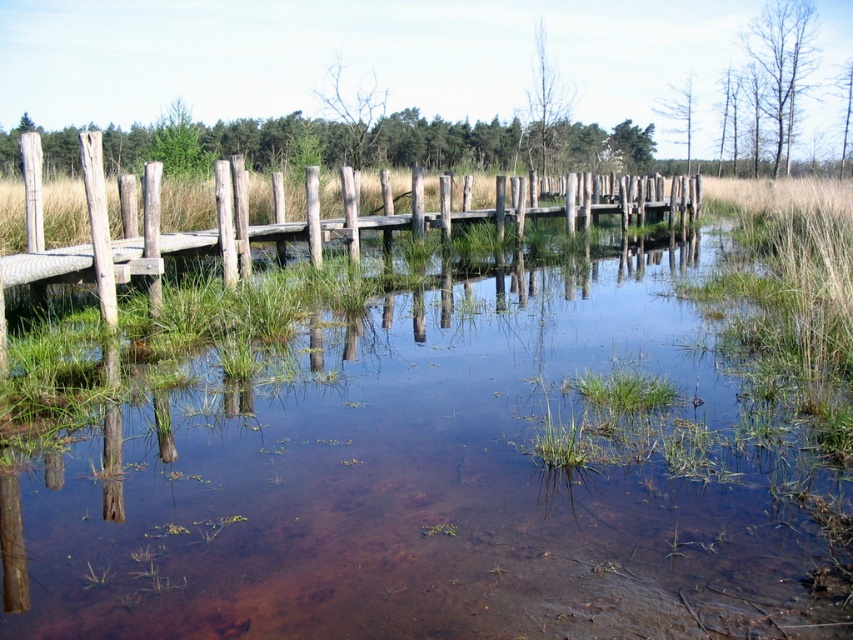
Between point (369, 372) and point (68, 256), which one is positioned behind?

The point (68, 256) is behind.

Is clear water at center positioned in front of wooden planks at center?

No, clear water at center is behind wooden planks at center.

What do you see at coordinates (427, 483) in the screenshot?
I see `clear water at center` at bounding box center [427, 483].

The height and width of the screenshot is (640, 853). Find the location of `clear water at center`. clear water at center is located at coordinates (427, 483).